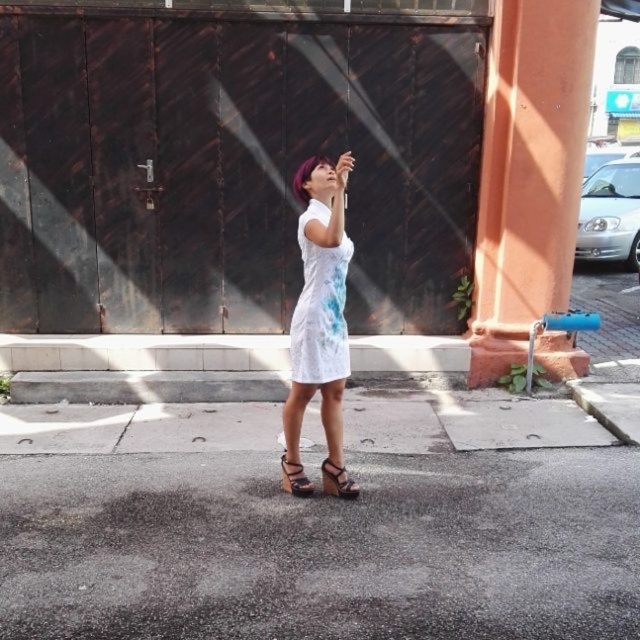
Question: Which point is farther to the camera?

Choices:
 (A) white lace dress at center
 (B) dark brown corrugated metal at center
 (C) matte black wedge sandal at center

Answer: (B)

Question: Is orange concrete pillar at right to the right of white lace dress at center from the viewer's perspective?

Choices:
 (A) yes
 (B) no

Answer: (A)

Question: Which is nearer to the dark brown corrugated metal at center?

Choices:
 (A) matte black wedge sandal at center
 (B) orange concrete pillar at right
 (C) white lace dress at center
 (D) white matte dress at center

Answer: (B)

Question: Is matte black wedge sandal at center smaller than brown leather sandal at center?

Choices:
 (A) no
 (B) yes

Answer: (B)

Question: Estimate the real-world distances between objects in this image. Which object is farther from the brown leather sandal at center?

Choices:
 (A) white matte dress at center
 (B) matte black wedge sandal at center

Answer: (A)

Question: Does matte black wedge sandal at center have a greater width compared to brown leather sandal at center?

Choices:
 (A) no
 (B) yes

Answer: (B)